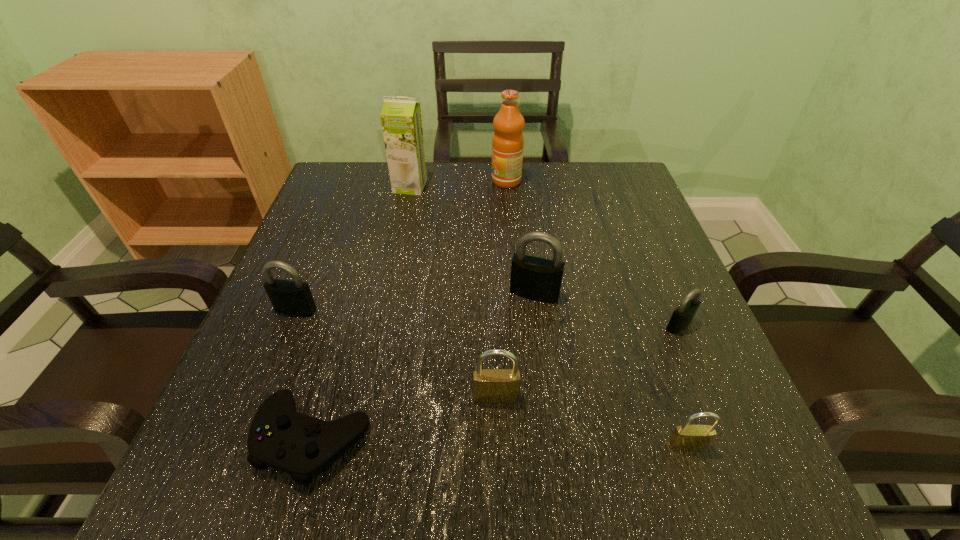
This screenshot has width=960, height=540. Identify the location of vacant space at the far edge. (394, 198).

Locate an element on the screen. This screenshot has width=960, height=540. free space at the near edge of the desktop is located at coordinates (420, 452).

Find the location of a particular element. This screenshot has width=960, height=540. free spot at the left edge of the desktop is located at coordinates (x=346, y=246).

You are a GUI agent. You are given a task and a screenshot of the screen. Output one action in this format:
    pyautogui.click(x=<x>, y=<y>)
    Task: Click on the blank space at the right edge of the desktop
    The width and height of the screenshot is (960, 540).
    Given the screenshot: What is the action you would take?
    pyautogui.click(x=637, y=367)

In the image, there is a desktop. Where is `vacant region at the near left corner`? vacant region at the near left corner is located at coordinates (285, 491).

You are a GUI agent. You are given a task and a screenshot of the screen. Output one action in this format:
    pyautogui.click(x=<x>, y=<y>)
    Task: Click on the free space at the far right corner of the desktop
    
    Given the screenshot: What is the action you would take?
    pyautogui.click(x=576, y=164)

Locate an element on the screen. vacant space at the near right corner of the desktop is located at coordinates (709, 465).

The height and width of the screenshot is (540, 960). I want to click on free space between the left brass padlock and the soya milk, so click(453, 292).

Identify the location of free point between the leftmost black padlock and the fruit juice. (401, 245).

I want to click on free space between the control and the fruit juice, so click(410, 309).